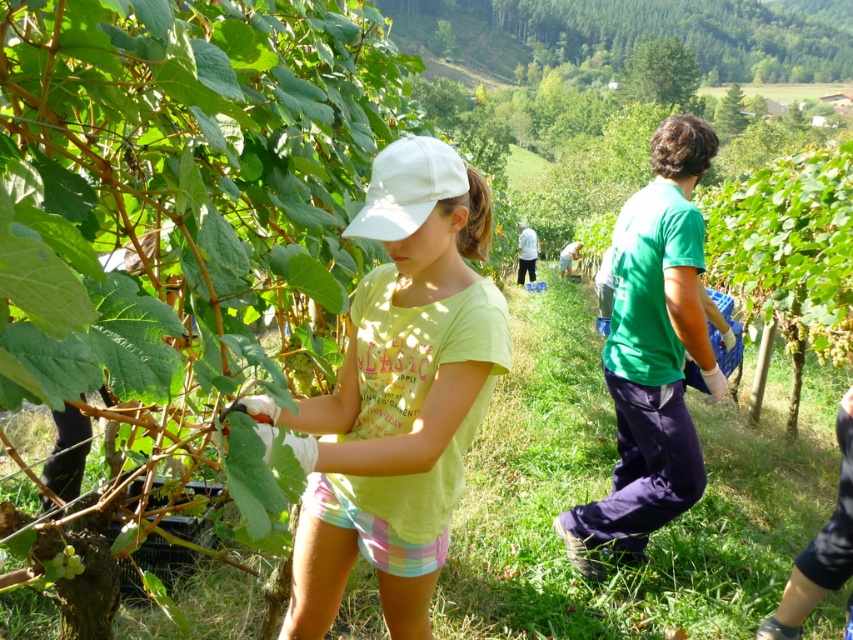
Is light green cotton shirt at center to the right of green matte grapes at lower left from the viewer's perspective?

Yes, light green cotton shirt at center is to the right of green matte grapes at lower left.

Can you confirm if light green cotton shirt at center is thinner than green matte grapes at lower left?

No, light green cotton shirt at center is not thinner than green matte grapes at lower left.

Who is more distant from viewer, [422,522] or [67,548]?

The point [67,548] is behind.

Locate an element on the screen. light green cotton shirt at center is located at coordinates (397, 394).